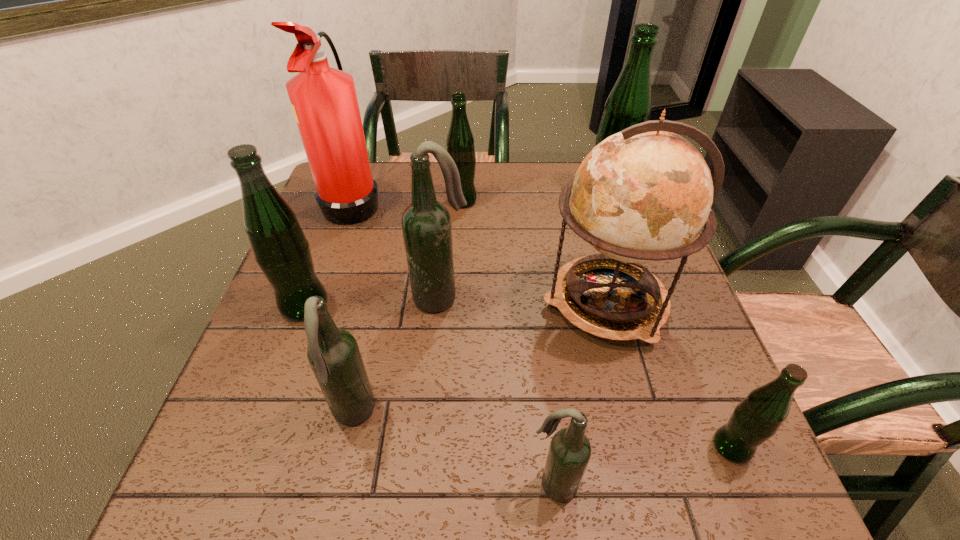
You are a GUI agent. You are given a task and a screenshot of the screen. Output one action in this format:
    pyautogui.click(x=<x>, y=<y>)
    Task: Click on the vacant area situated 0.070m on the right of the third object from left to right
    
    Given the screenshot: What is the action you would take?
    pyautogui.click(x=414, y=415)

The width and height of the screenshot is (960, 540). Find the location of `free space located 0.280m on the right of the second smallest green beer bottle`. free space located 0.280m on the right of the second smallest green beer bottle is located at coordinates (576, 201).

The image size is (960, 540). What are the coordinates of `vacant space located 0.150m on the back of the nearest green beer bottle` in the screenshot? It's located at (695, 357).

Locate an element on the screen. This screenshot has height=540, width=960. vacant space located 0.070m on the left of the smallest dark beer bottle is located at coordinates (486, 484).

Find the location of a particular element. This screenshot has height=540, width=960. fire extinguisher located at the far edge is located at coordinates (324, 101).

At what (x,y) coordinates should I click in order to perform the action: click on fire extinguisher that is positioned at the left edge. Please return your answer as a coordinate pair (x, y). Looking at the image, I should click on (324, 101).

The width and height of the screenshot is (960, 540). What are the coordinates of `beer bottle that is at the left edge` in the screenshot? It's located at (280, 248).

I want to click on globe that is at the right edge, so click(x=642, y=195).

Identify the location of object positioned at the far left corner. (324, 101).

Find the location of `object at the far right corner`. object at the far right corner is located at coordinates (630, 102).